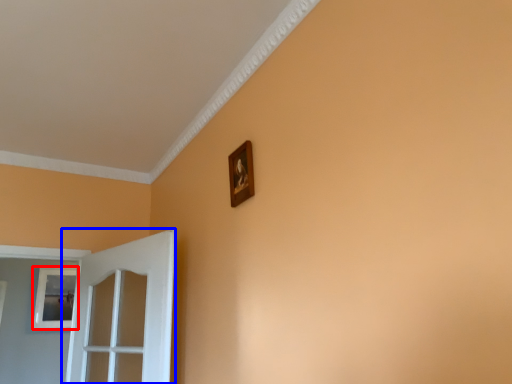
Question: Which of the following is the farthest to the observer, picture frame (highlighted by a red box) or door (highlighted by a blue box)?

Choices:
 (A) picture frame
 (B) door

Answer: (A)